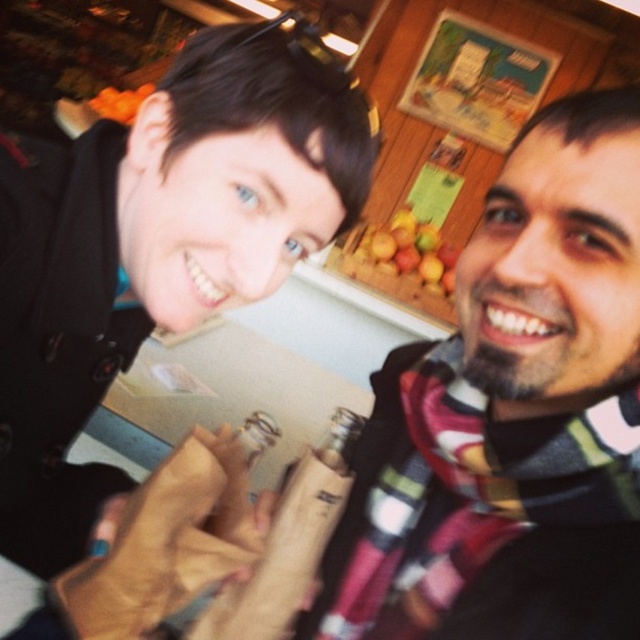
Question: Among these objects, which one is farthest from the camera?

Choices:
 (A) plaid wool scarf at right
 (B) flannel scarf at right
 (C) smooth wooden board at upper center

Answer: (C)

Question: Does flannel scarf at right have a smaller size compared to plaid wool scarf at right?

Choices:
 (A) yes
 (B) no

Answer: (B)

Question: Is plaid wool scarf at right to the right of smooth wooden board at upper center from the viewer's perspective?

Choices:
 (A) yes
 (B) no

Answer: (B)

Question: Which object is farther from the camera taking this photo?

Choices:
 (A) smooth wooden board at upper center
 (B) flannel scarf at right

Answer: (A)

Question: Is plaid wool scarf at right to the right of smooth wooden board at upper center from the viewer's perspective?

Choices:
 (A) no
 (B) yes

Answer: (A)

Question: Which of the following is the closest to the observer?

Choices:
 (A) (212, 182)
 (B) (394, 440)
 (C) (449, 292)

Answer: (A)